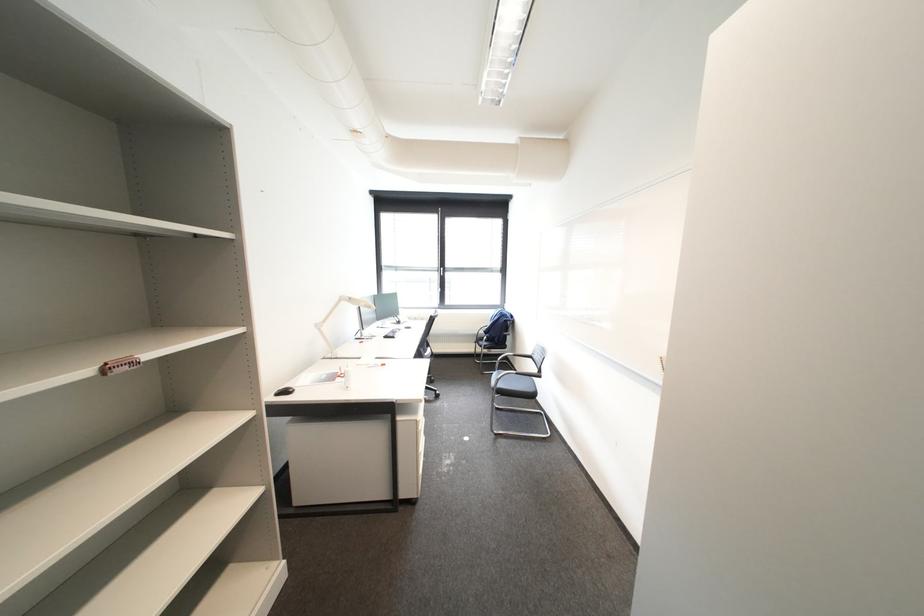
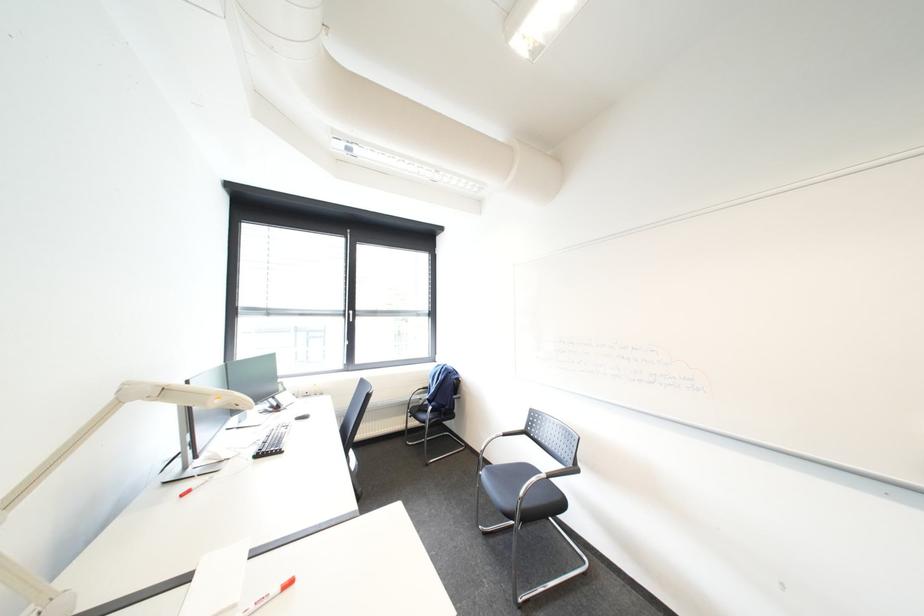
What movement of the cameraman would produce the second image?

The movement direction of the cameraman is left, forward.